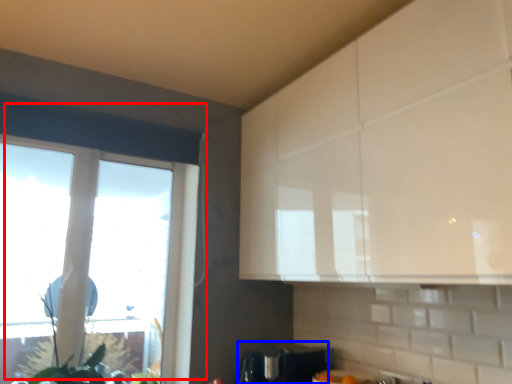
Question: Which of the following is the closest to the observer, window (highlighted by a red box) or appliance (highlighted by a blue box)?

Choices:
 (A) window
 (B) appliance

Answer: (A)